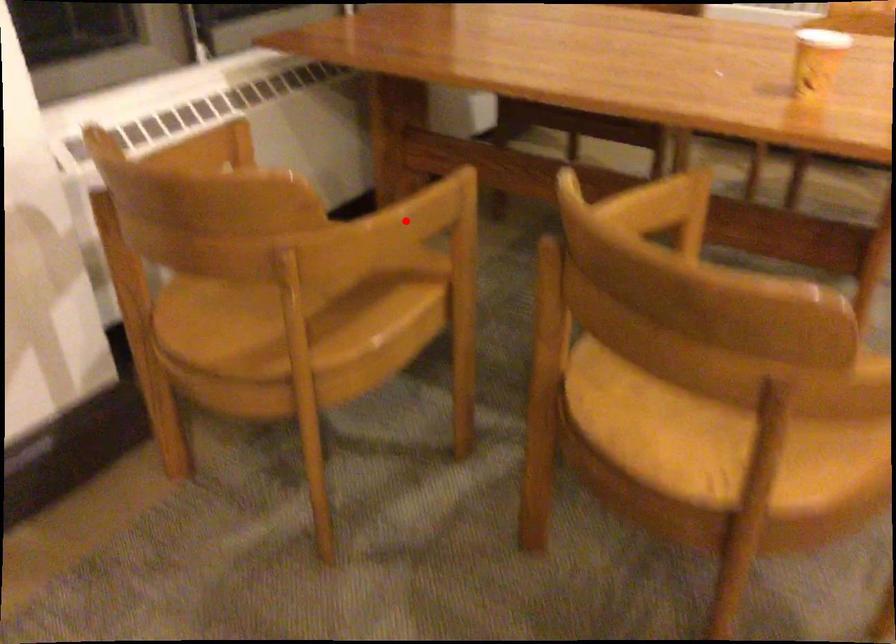
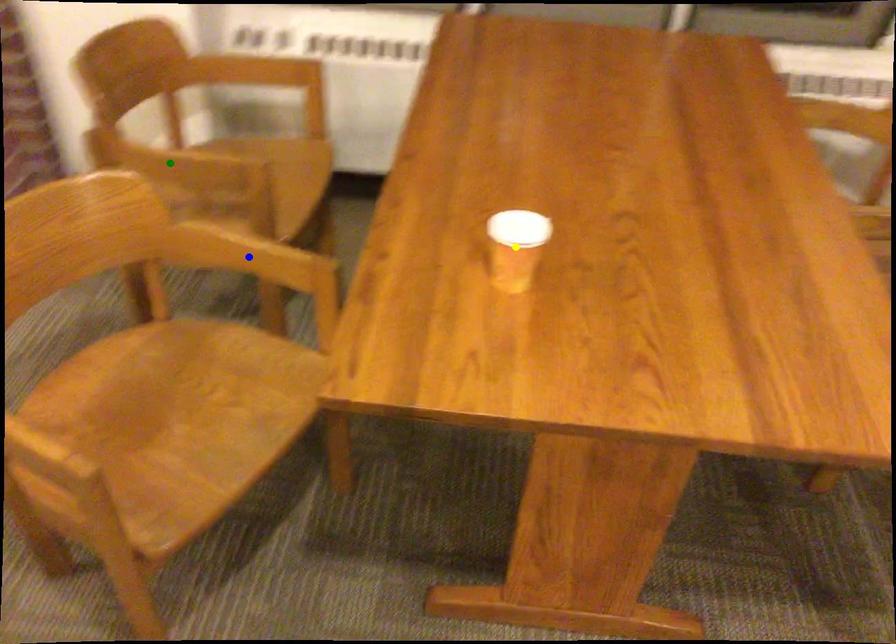
Question: I am providing you with two images of the same scene from different viewpoints. A red point is marked on the first image. You are given multiple points on the second image. Which point in image 2 is actually the same real-world point as the red point in image 1?

Choices:
 (A) blue point
 (B) green point
 (C) yellow point

Answer: (B)